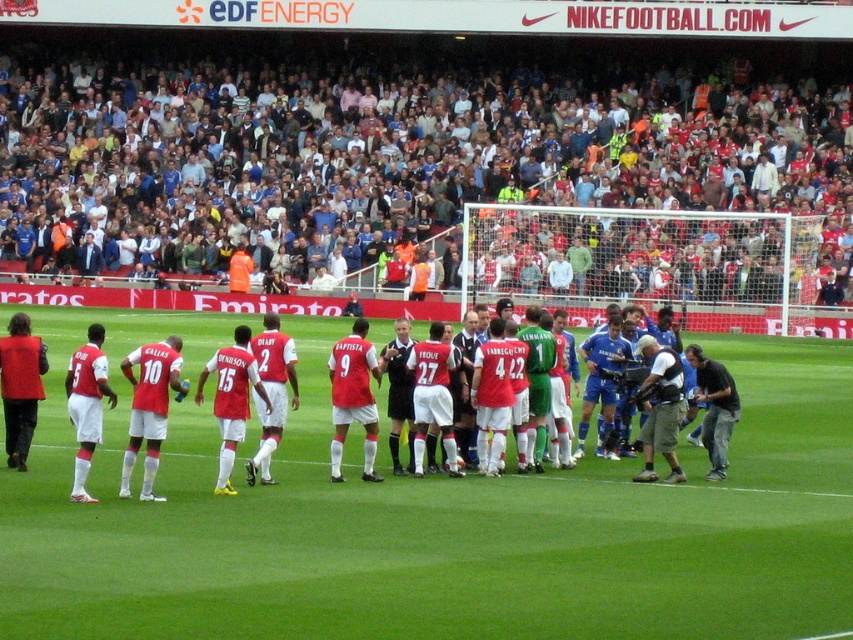
Question: Does green grass field at center have a lesser width compared to dark gray fabric camera at lower right?

Choices:
 (A) yes
 (B) no

Answer: (B)

Question: Which point is closer to the camera?

Choices:
 (A) (305, 518)
 (B) (695, 346)
 (C) (9, 221)

Answer: (A)

Question: Can you confirm if green grass field at center is wider than white matte soccer team at center?

Choices:
 (A) no
 (B) yes

Answer: (A)

Question: Among these points, which one is farthest from the camera?

Choices:
 (A) coord(712,474)
 (B) coord(389,525)

Answer: (A)

Question: Which point is closer to the camera?

Choices:
 (A) (260, 209)
 (B) (708, 378)
 (C) (567, 525)

Answer: (C)

Question: Is the position of white fabric crowd at upper center more distant than that of white matte soccer team at center?

Choices:
 (A) yes
 (B) no

Answer: (A)